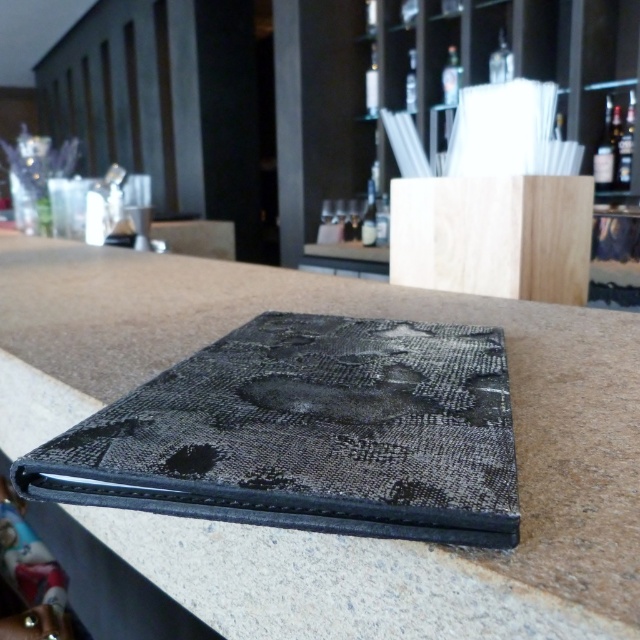
You are a bartender who needs to place both the black leather wallet at center and the matte glass bottle at center on a small shelf. Which object should you place first to ensure both fit?

The black leather wallet at center is larger than the matte glass bottle at center, so you should place the matte glass bottle at center first to accommodate the larger wallet.

You are a bartender preparing to arrange bottles on a narrow shelf. You have the matte black bottle at upper right and the clear glass bottle at upper right. Which bottle should you place first to fit both on the shelf?

The matte black bottle at upper right occupies less space than the clear glass bottle at upper right, so you should place the clear glass bottle at upper right first to ensure both fit on the narrow shelf.